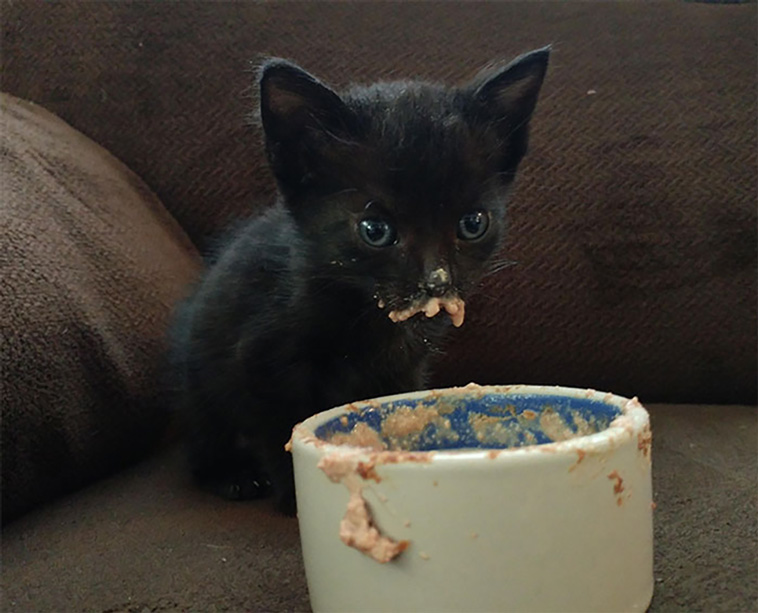
Image resolution: width=758 pixels, height=613 pixels. Find the location of `couch`. couch is located at coordinates point(170,538).